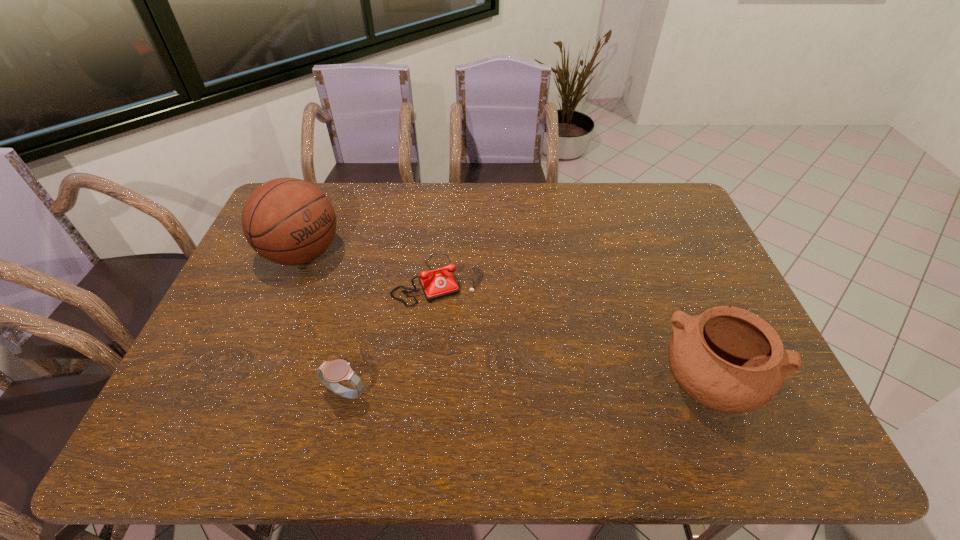
At what (x,y) coordinates should I click in order to perform the action: click on free space located 0.300m on the dial of the telephone. Please return your answer as a coordinate pair (x, y). Looking at the image, I should click on (492, 396).

You are a GUI agent. You are given a task and a screenshot of the screen. Output one action in this format:
    pyautogui.click(x=<x>, y=<y>)
    Task: Click on the vacant region located 0.220m on the dial of the telephone
    
    Given the screenshot: What is the action you would take?
    pyautogui.click(x=480, y=369)

What are the coordinates of `vacant region located on the dial of the telephone` in the screenshot? It's located at tap(469, 345).

Find the location of `free space located 0.160m on the side with brand label of the basketball`. free space located 0.160m on the side with brand label of the basketball is located at coordinates (369, 292).

Find the location of a particular element. free space located on the side with brand label of the basketball is located at coordinates (358, 287).

This screenshot has width=960, height=540. Find the location of `vacant region located 0.190m on the side with brand label of the basketball`. vacant region located 0.190m on the side with brand label of the basketball is located at coordinates (375, 297).

I want to click on watch that is at the near edge, so click(330, 373).

Locate an element on the screen. The width and height of the screenshot is (960, 540). pottery situated at the near edge is located at coordinates (728, 359).

You are a GUI agent. You are given a task and a screenshot of the screen. Output one action in this format:
    pyautogui.click(x=<x>, y=<y>)
    Task: Click on the object that is at the left edge
    The image size is (960, 540).
    Given the screenshot: What is the action you would take?
    pyautogui.click(x=288, y=221)

You are a GUI agent. You are given a task and a screenshot of the screen. Output one action in this format:
    pyautogui.click(x=<x>, y=<y>)
    Task: Click on the object located at the right edge
    This screenshot has height=540, width=960.
    Given the screenshot: What is the action you would take?
    pyautogui.click(x=728, y=359)